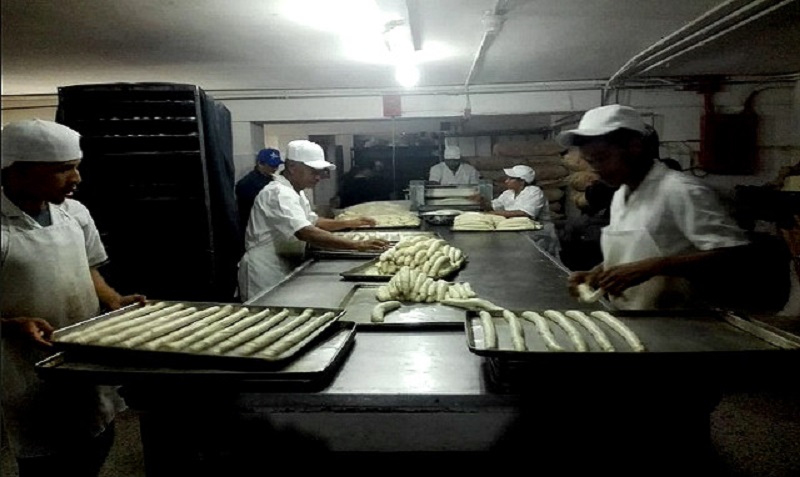
Identify the location of tray. This screenshot has height=477, width=800. (318, 362).